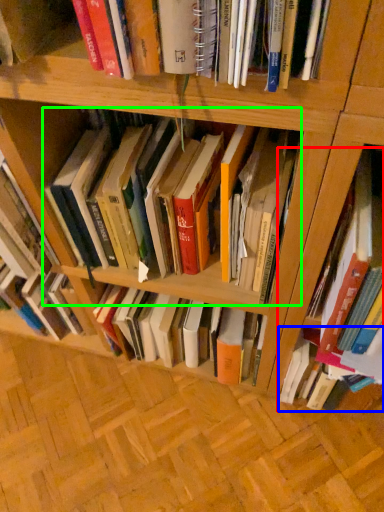
Question: Which object is positioned closest to book (highlighted by a red box)? Select from book (highlighted by a blue box) and book (highlighted by a green box).

Choices:
 (A) book
 (B) book

Answer: (A)